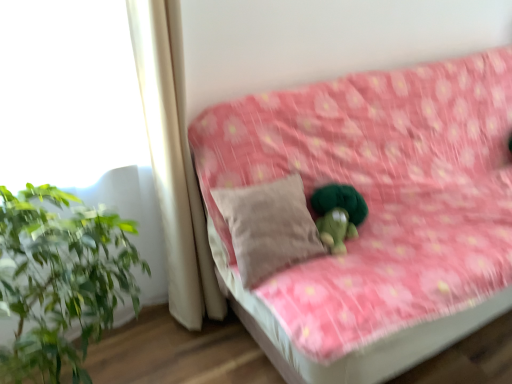
Question: Considering their positions, is white fabric curtain at left located in front of or behind beige fabric pillow at center?

Choices:
 (A) behind
 (B) front

Answer: (B)

Question: Do you think white fabric curtain at left is within beige fabric pillow at center, or outside of it?

Choices:
 (A) inside
 (B) outside

Answer: (B)

Question: Estimate the real-world distances between objects in this image. Which object is closer to the beige fabric pillow at center?

Choices:
 (A) white fabric curtain at left
 (B) pink floral fabric couch at center

Answer: (A)

Question: Which object is positioned closest to the white fabric curtain at left?

Choices:
 (A) beige fabric pillow at center
 (B) pink floral fabric couch at center

Answer: (A)